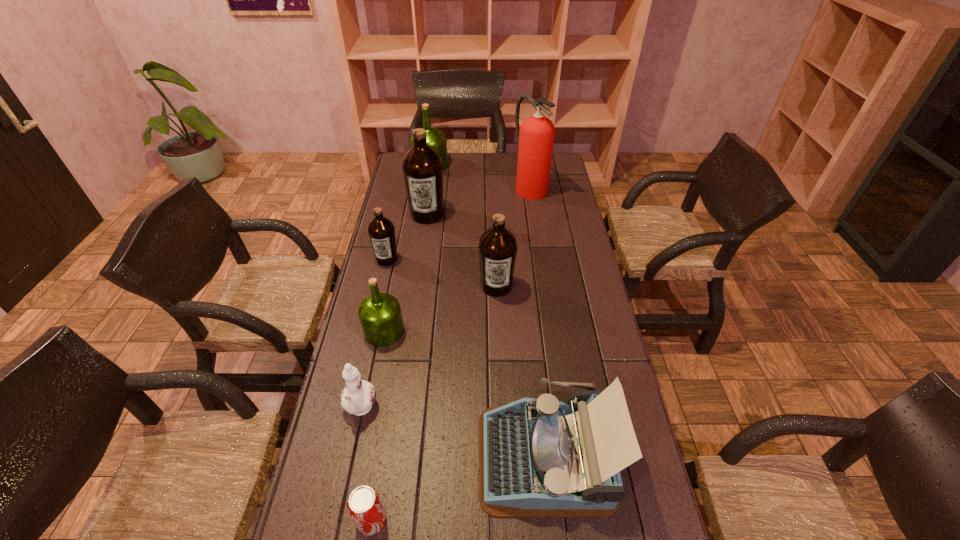
Identify the location of blank space located 0.170m on the typing side of the typewriter. The image size is (960, 540). pyautogui.click(x=412, y=456).

Locate an element on the screen. This screenshot has height=540, width=960. free space located 0.400m on the typing side of the typewriter is located at coordinates (322, 456).

This screenshot has height=540, width=960. Find the location of `vacant space situated on the typing side of the typewriter`. vacant space situated on the typing side of the typewriter is located at coordinates (427, 456).

Identify the location of vacant area located at the spout of the chinaware. Image resolution: width=960 pixels, height=540 pixels. [337, 521].

Image resolution: width=960 pixels, height=540 pixels. Find the location of `free space located 0.110m on the left of the soda can`. free space located 0.110m on the left of the soda can is located at coordinates (309, 520).

This screenshot has width=960, height=540. In order to click on fire extinguisher that is at the far edge in this screenshot , I will do `click(535, 137)`.

Where is `olive oil that is at the far edge`? The height and width of the screenshot is (540, 960). olive oil that is at the far edge is located at coordinates (436, 139).

Locate an element on the screen. The image size is (960, 540). chinaware that is positioned at the left edge is located at coordinates (358, 396).

This screenshot has height=540, width=960. What are the coordinates of `soda can that is positioned at the left edge` in the screenshot? It's located at (364, 505).

At what (x,y) coordinates should I click in order to perform the action: click on fire extinguisher present at the right edge. Please return your answer as a coordinate pair (x, y). This screenshot has width=960, height=540. Looking at the image, I should click on (535, 137).